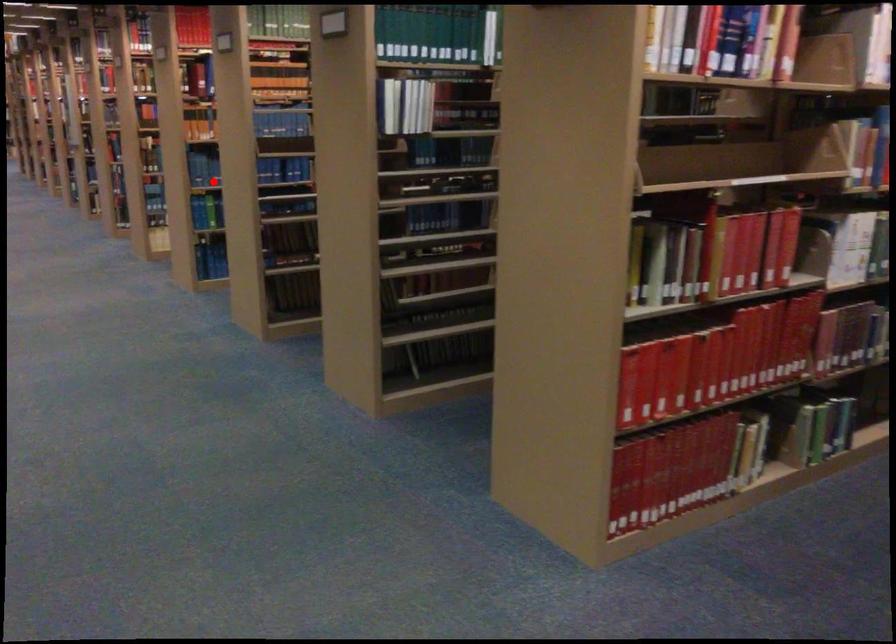
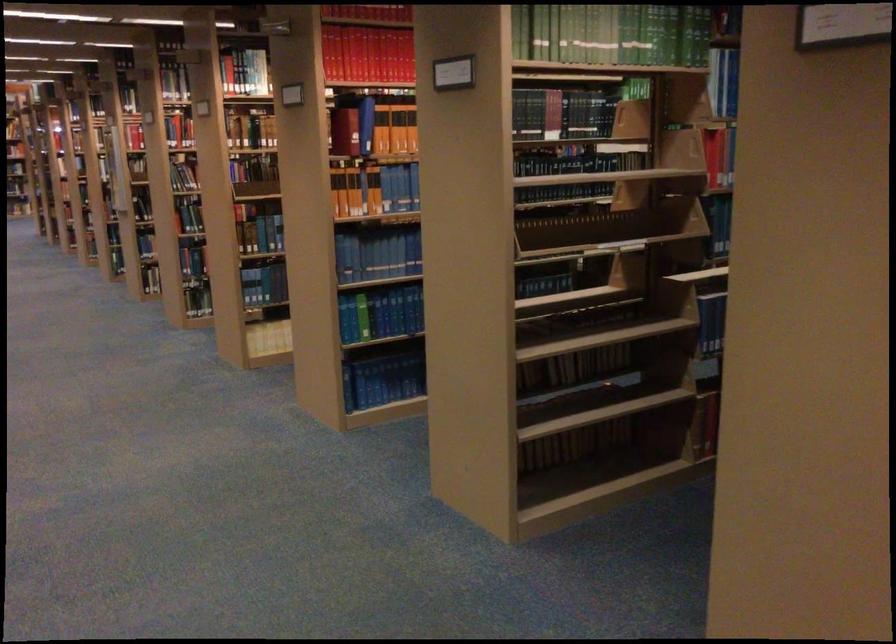
Question: I am providing you with two images of the same scene from different viewpoints. In image1, a red point is highlighted. Considering the same 3D point in image2, which of the following is correct?

Choices:
 (A) It is closer
 (B) It is farther

Answer: (A)